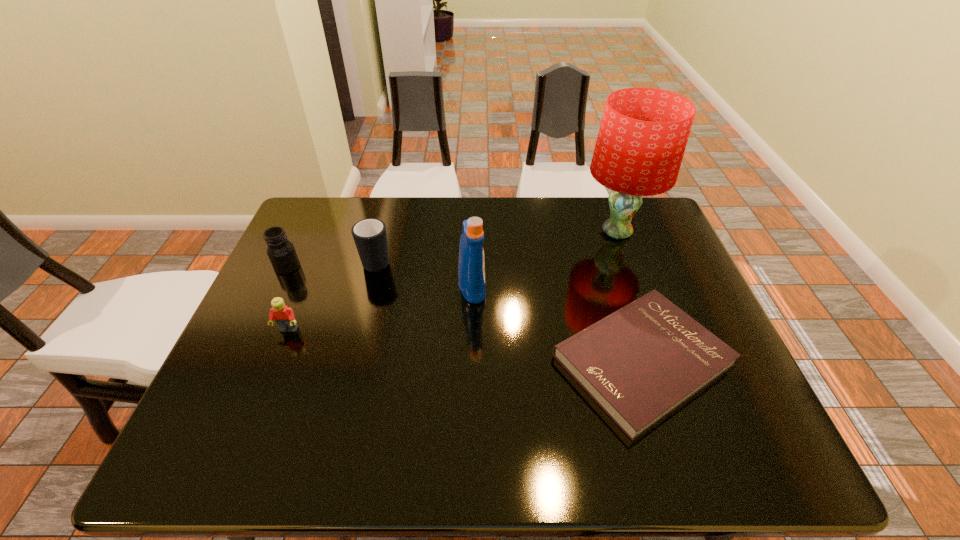
Identify the location of free spot at the far left corner of the desktop. (300, 238).

What are the coordinates of `free space at the far right corner of the desktop` in the screenshot? It's located at (651, 198).

Where is `vacant space that is in between the lampshade and the Lego`? The image size is (960, 540). vacant space that is in between the lampshade and the Lego is located at coordinates (453, 281).

Identify the location of vacant space in between the jar and the tallest object. The height and width of the screenshot is (540, 960). (452, 249).

The height and width of the screenshot is (540, 960). I want to click on free spot between the shortest object and the third object from left to right, so coord(510,310).

Find the location of a particular element. Image resolution: width=960 pixels, height=540 pixels. unoccupied area between the tallest object and the fourth object from left to right is located at coordinates (544, 260).

You are a GUI agent. You are given a task and a screenshot of the screen. Output one action in this format:
    pyautogui.click(x=<x>, y=<y>)
    Task: Click on the vacant area that lies between the mug and the shortest object
    
    Given the screenshot: What is the action you would take?
    pyautogui.click(x=510, y=310)

I want to click on free spot between the Lego and the lampshade, so click(453, 281).

The width and height of the screenshot is (960, 540). I want to click on free space between the hardback book and the fifth shortest object, so click(557, 323).

You are a GUI agent. You are given a task and a screenshot of the screen. Output one action in this format:
    pyautogui.click(x=<x>, y=<y>)
    Task: Click on the vacant point located between the fourth object from left to right and the mug
    This screenshot has width=960, height=540.
    Given the screenshot: What is the action you would take?
    pyautogui.click(x=424, y=273)